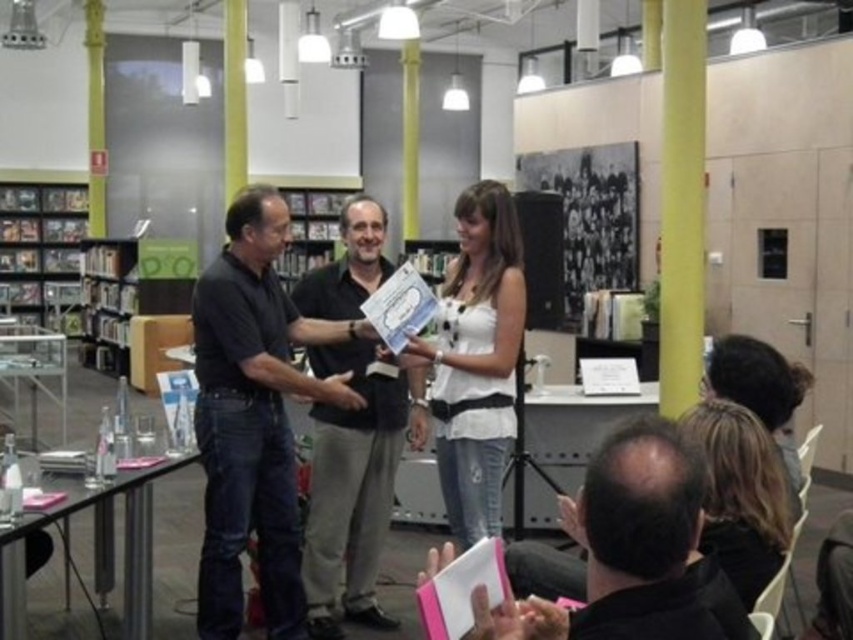
Question: Is dark gray shirt at center below black matte shirt at lower right?

Choices:
 (A) no
 (B) yes

Answer: (A)

Question: Which point appears closest to the camera in this image?

Choices:
 (A) pos(334,314)
 (B) pos(461,486)
 (C) pos(728,467)

Answer: (C)

Question: Considering the real-world distances, which object is closest to the black matte shirt at center?

Choices:
 (A) white denim jeans at center
 (B) blonde hair at lower right
 (C) dark gray shirt at center

Answer: (C)

Question: Is black matte shirt at center wider than black matte shirt at lower right?

Choices:
 (A) yes
 (B) no

Answer: (A)

Question: Is black matte shirt at center above dark gray shirt at center?

Choices:
 (A) yes
 (B) no

Answer: (A)

Question: Which object appears closest to the camera in this image?

Choices:
 (A) black matte shirt at center
 (B) black matte shirt at lower right
 (C) dark gray shirt at center

Answer: (B)